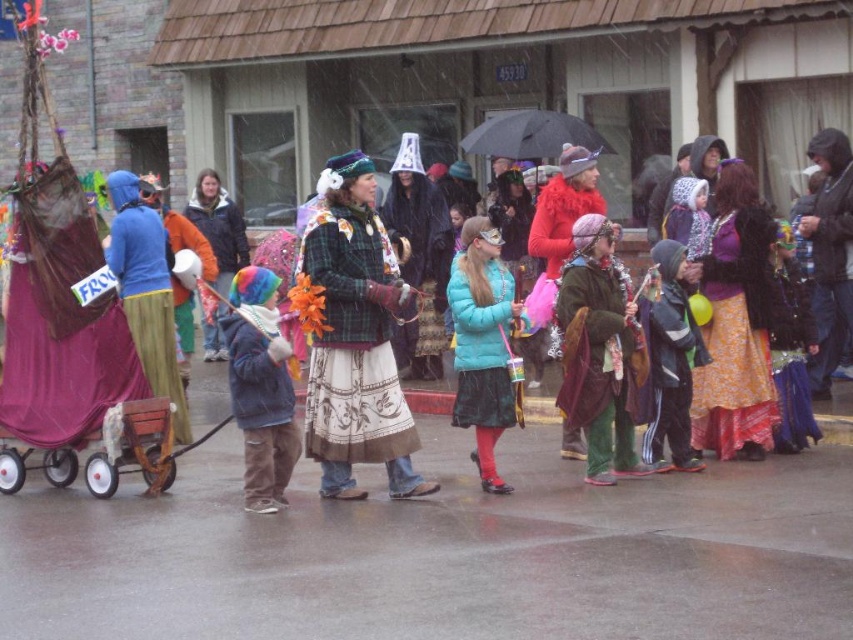
Question: Which of the following is the closest to the observer?

Choices:
 (A) denim jacket at center
 (B) plaid woolen coat at center
 (C) matte purple fabric at left
 (D) teal matte jacket at center

Answer: (A)

Question: Is orange floral skirt at center to the right of dark gray fleece jacket at center from the viewer's perspective?

Choices:
 (A) yes
 (B) no

Answer: (A)

Question: From the image, what is the correct spatial relationship of teal matte jacket at center in relation to blue fuzzy hat at left?

Choices:
 (A) left
 (B) right

Answer: (B)

Question: Which point appears farthest from the camera in this image?

Choices:
 (A) (844, 426)
 (B) (595, 332)
 (C) (270, 506)
 (D) (680, 332)

Answer: (A)

Question: Does matte purple fabric at left have a smaller size compared to orange fleece jacket at center?

Choices:
 (A) yes
 (B) no

Answer: (A)

Question: Which point is farther to the camera?

Choices:
 (A) (648, 332)
 (B) (345, 312)
 (C) (498, 352)

Answer: (A)